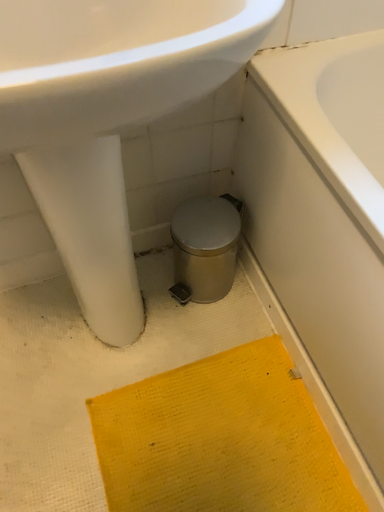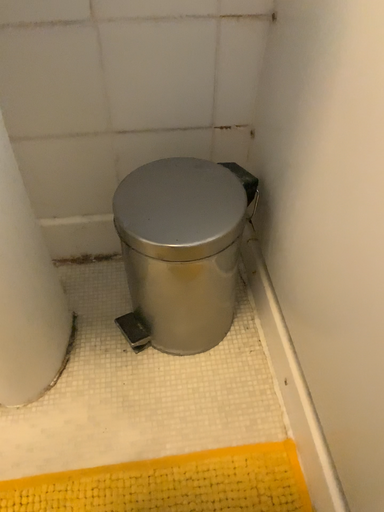
Question: Which way did the camera rotate in the video?

Choices:
 (A) rotated left
 (B) rotated right

Answer: (A)